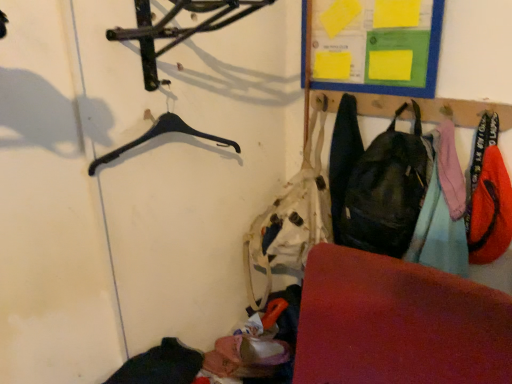
Question: From a real-world perspective, is matte black backpack at center-right, which is counted as the 1th clothing, starting from the left, physically above matte black backpack at right?

Choices:
 (A) no
 (B) yes

Answer: (A)

Question: Does matte black backpack at center-right, the 3th clothing viewed from the right, have a smaller size compared to matte black backpack at right?

Choices:
 (A) yes
 (B) no

Answer: (A)

Question: Considering the relative positions of matte black backpack at center-right, which is counted as the 1th clothing, starting from the left, and matte black backpack at right in the image provided, is matte black backpack at center-right, which is counted as the 1th clothing, starting from the left, to the left of matte black backpack at right from the viewer's perspective?

Choices:
 (A) yes
 (B) no

Answer: (A)

Question: Is matte black backpack at center-right, the 3th clothing viewed from the right, located outside matte black backpack at right?

Choices:
 (A) yes
 (B) no

Answer: (A)

Question: Can matte black backpack at right be found inside matte black backpack at center-right, the 3th clothing viewed from the right?

Choices:
 (A) yes
 (B) no

Answer: (B)

Question: Based on their sizes in the image, would you say rubberized red mat at lower right is bigger or smaller than black plastic hanger at upper left?

Choices:
 (A) small
 (B) big

Answer: (B)

Question: From the image's perspective, is rubberized red mat at lower right located above or below black plastic hanger at upper left?

Choices:
 (A) above
 (B) below

Answer: (B)

Question: Considering their positions, is rubberized red mat at lower right located in front of or behind black plastic hanger at upper left?

Choices:
 (A) front
 (B) behind

Answer: (A)

Question: From a real-world perspective, is rubberized red mat at lower right physically located above or below black plastic hanger at upper left?

Choices:
 (A) below
 (B) above

Answer: (A)

Question: Is point (458, 264) closer or farther from the camera than point (321, 370)?

Choices:
 (A) closer
 (B) farther

Answer: (B)

Question: Looking at the image, does orange fabric pants at right, the second clothing positioned from the left, seem bigger or smaller compared to rubberized red mat at lower right?

Choices:
 (A) big
 (B) small

Answer: (B)

Question: From a real-world perspective, is orange fabric pants at right, the second clothing positioned from the left, positioned above or below rubberized red mat at lower right?

Choices:
 (A) above
 (B) below

Answer: (A)

Question: From the image's perspective, relative to rubberized red mat at lower right, is orange fabric pants at right, the second clothing positioned from the right, above or below?

Choices:
 (A) below
 (B) above

Answer: (B)

Question: Choose the correct answer: Is orange fabric pants at right, the second clothing positioned from the right, inside black plastic hanger at upper left or outside it?

Choices:
 (A) outside
 (B) inside

Answer: (A)

Question: Would you say orange fabric pants at right, the second clothing positioned from the left, is to the left or to the right of black plastic hanger at upper left in the picture?

Choices:
 (A) left
 (B) right

Answer: (B)